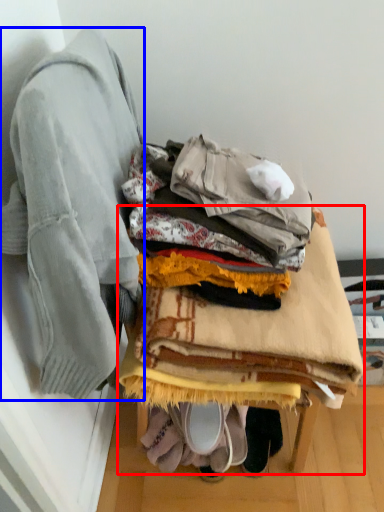
Question: Which of the following is the farthest to the observer, furniture (highlighted by a red box) or jacket (highlighted by a blue box)?

Choices:
 (A) furniture
 (B) jacket

Answer: (A)